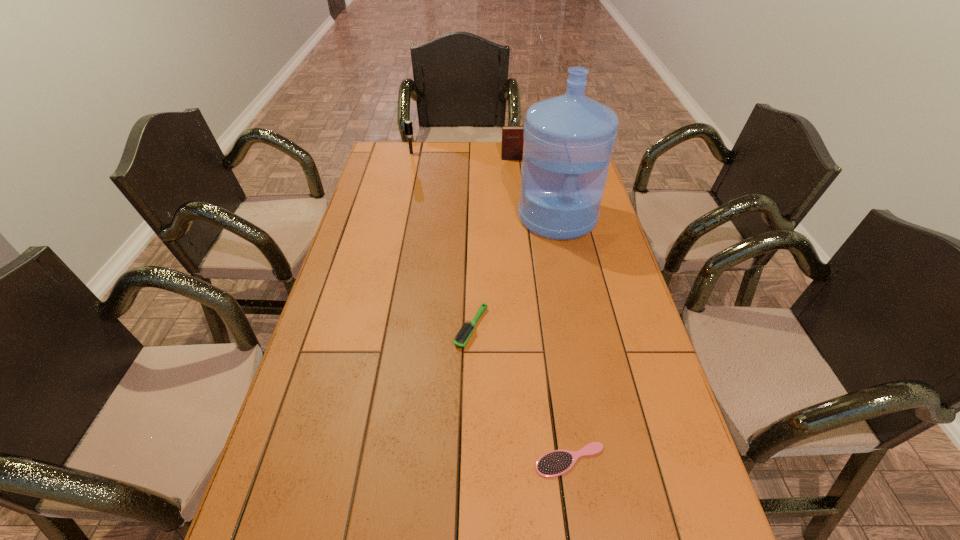
In order to click on the third farthest object in this screenshot , I will do `click(568, 143)`.

Where is `the tallest object`? Image resolution: width=960 pixels, height=540 pixels. the tallest object is located at coordinates (568, 143).

You are a GUI agent. You are given a task and a screenshot of the screen. Output one action in this format:
    pyautogui.click(x=<x>, y=<y>)
    Task: Click on the leftmost hairbrush
    The image size is (960, 540).
    Given the screenshot: What is the action you would take?
    pyautogui.click(x=408, y=126)

You are a GUI agent. You are given a task and a screenshot of the screen. Output one action in this format:
    pyautogui.click(x=<x>, y=<y>)
    Task: Click on the farthest object
    The width and height of the screenshot is (960, 540).
    Given the screenshot: What is the action you would take?
    pyautogui.click(x=408, y=126)

This screenshot has height=540, width=960. Identify the location of diary. (512, 136).

Locate an element on the screen. This screenshot has height=540, width=960. the second farthest hairbrush is located at coordinates (462, 337).

Where is `the second object from left to right`? This screenshot has width=960, height=540. the second object from left to right is located at coordinates (462, 337).

Where is `the rightmost hairbrush`? This screenshot has width=960, height=540. the rightmost hairbrush is located at coordinates (555, 463).

Find the location of a particular element. The height and width of the screenshot is (540, 960). the nearest hairbrush is located at coordinates (555, 463).

In order to click on vacant region located 0.370m on the side of the water jug with the handle in this screenshot , I will do `click(581, 329)`.